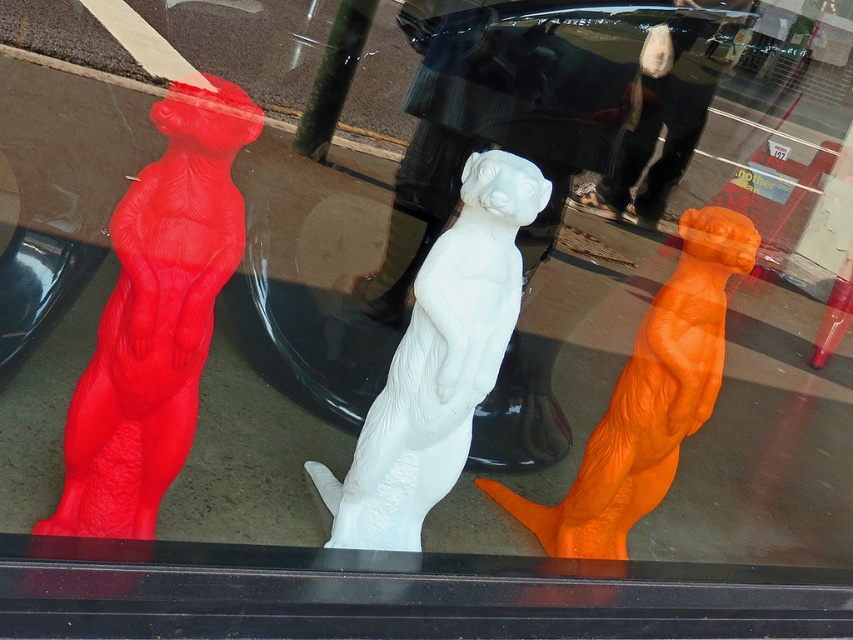
You are a delivery person who needs to place a package at the point closest to the red meerkat sculpture. The shop window has two points marked at coordinates point (216,253) and point (397,472). Which point should you choose?

Point (216,253) is in front of point (397,472), so it is closer to the red meerkat sculpture. Therefore, you should choose point (216,253).

You are a customer in the shop looking at the sculptures through the window. You notice the matte red statue at left and the orange matte otter at center. Which sculpture is wider?

The orange matte otter at center is wider than the matte red statue at left because the matte red statue at left has a smaller width.

You are standing in front of the shop window and want to locate the matte red statue at left. What are the coordinates where you can find it?

The matte red statue at left is located at coordinates point (155, 316).